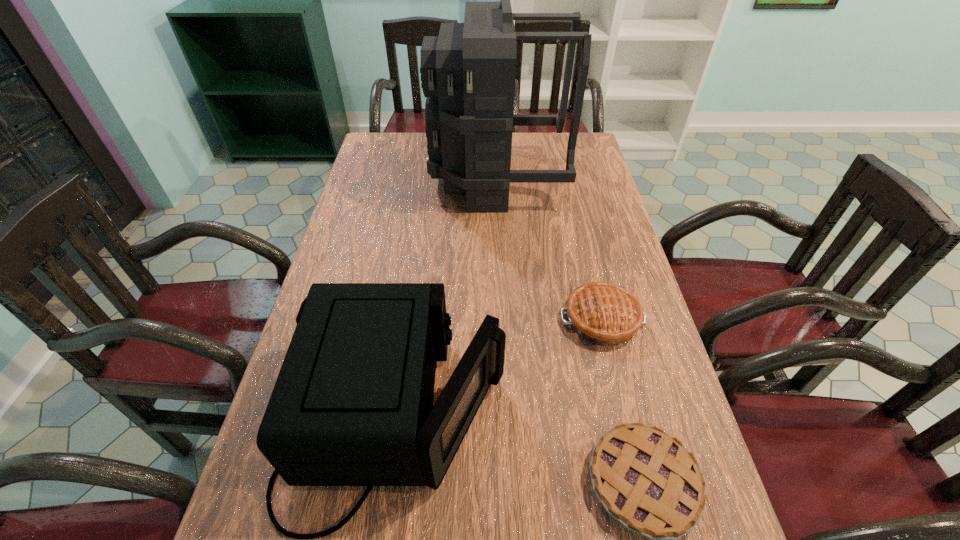
The width and height of the screenshot is (960, 540). What are the coordinates of `the farthest object` in the screenshot? It's located at pyautogui.click(x=468, y=72).

Where is `backpack`? This screenshot has width=960, height=540. backpack is located at coordinates (468, 72).

Locate an element on the screen. Image resolution: width=960 pixels, height=540 pixels. microwave oven is located at coordinates (352, 405).

You are a GUI agent. You are given a task and a screenshot of the screen. Output one action in this format:
    pyautogui.click(x=<x>, y=<y>)
    Task: Click on the taller pie
    This screenshot has width=960, height=540.
    Given the screenshot: What is the action you would take?
    pyautogui.click(x=605, y=314)

Where is `the farther pie`? This screenshot has height=540, width=960. the farther pie is located at coordinates (605, 314).

The image size is (960, 540). Find the location of `vacant space located on the front compartment of the farthest object`. vacant space located on the front compartment of the farthest object is located at coordinates (390, 179).

Where is `vacant region located on the front compartment of the farthest object`? The height and width of the screenshot is (540, 960). vacant region located on the front compartment of the farthest object is located at coordinates (390, 179).

Locate an element on the screen. This screenshot has width=960, height=540. vacant space situated 0.160m on the front compartment of the farthest object is located at coordinates (387, 179).

At what (x,y) coordinates should I click in order to perform the action: click on vacant point located with the door open on the microwave oven. Please return your answer as a coordinate pair (x, y). The image size is (960, 540). Looking at the image, I should click on click(x=653, y=418).

Where is `vacant space located on the front of the third tallest object`? vacant space located on the front of the third tallest object is located at coordinates (613, 367).